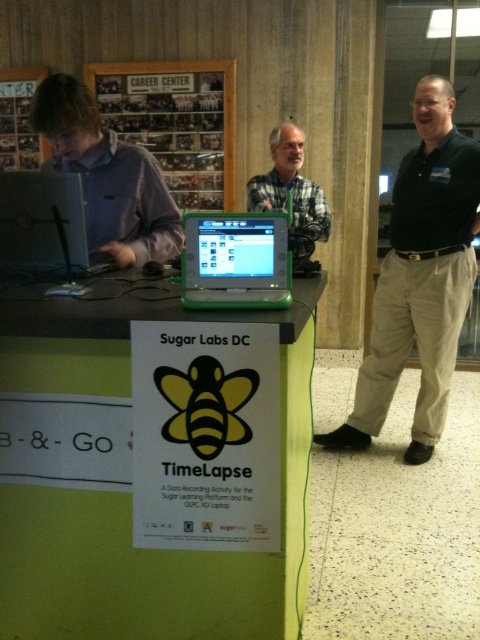
You are organizing a tech event and need to decide which volunteer to assign to a booth that requires reaching high shelves. The booth has volunteers wearing either the matte purple shirt at left or the gray flannel shirt at center. Based on their height, which volunteer should you choose?

The gray flannel shirt at center is taller than the matte purple shirt at left, so the volunteer wearing the gray flannel shirt at center should be chosen for the task requiring reaching high shelves.

You are a photographer at the event and need to capture a photo of both the matte purple shirt at left and the gray flannel shirt at center. Your camera has a maximum focus range of 1.5 meters. Can you fit both shirts into the frame without moving the camera?

The distance between the matte purple shirt at left and the gray flannel shirt at center is 1.43 meters, which is within the camera maximum focus range of 1.5 meters. Yes, you can fit both shirts into the frame without moving the camera.

You are at a tech event and see the wooden frame at upper center and the matte purple shirt at left. According to the scene, which object is positioned higher from the ground?

The wooden frame at upper center is located above matte purple shirt at left, so the wooden frame at upper center is positioned higher from the ground.